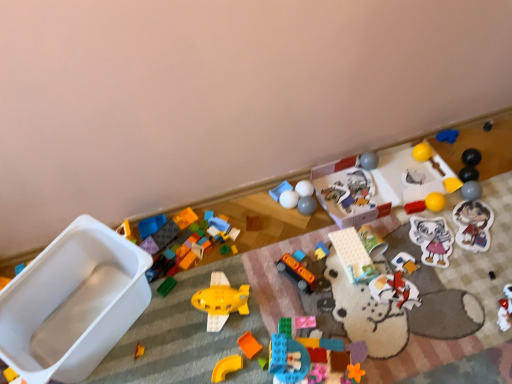
At what (x,y) coordinates should I click in order to perform the action: click on free space that is in between white matte figure at center, the nineteenth toy viewed from the left, and matte gray ball at right, which appears as the 24th toy when viewed from the left. Please return your answer as a coordinate pair (x, y). Image resolution: width=512 pixels, height=384 pixels. Looking at the image, I should click on (433, 239).